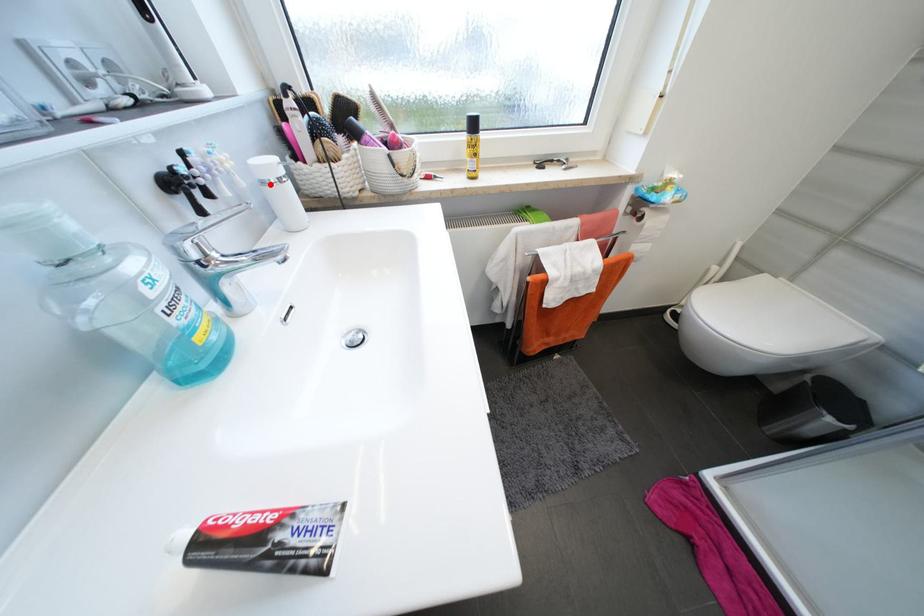
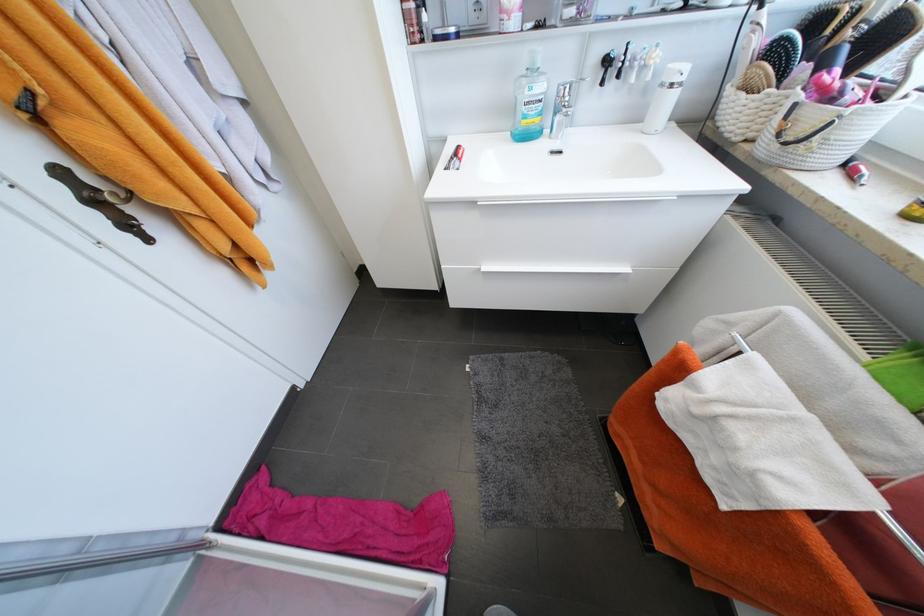
Where in the second image is the point corresponding to the highlighted location from the first image?

(667, 86)